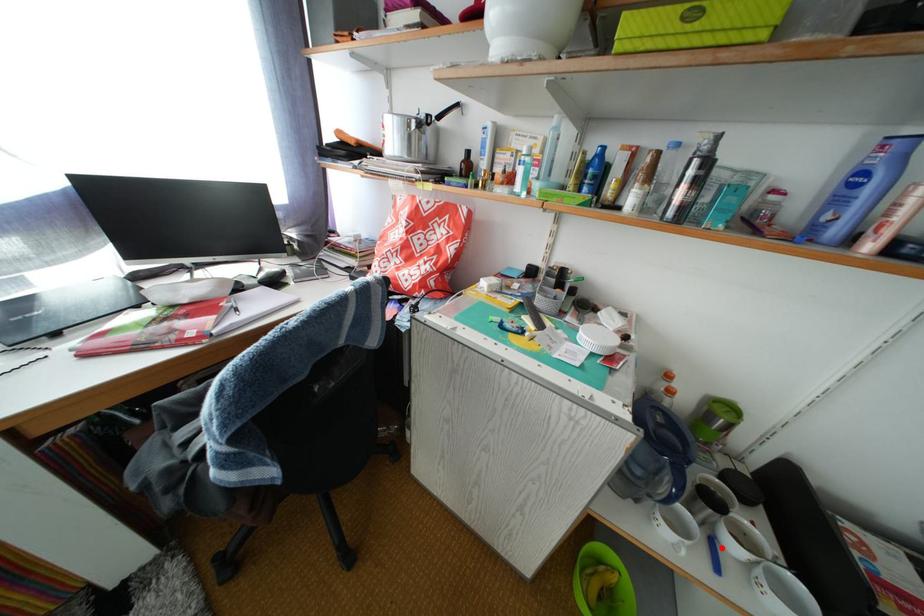
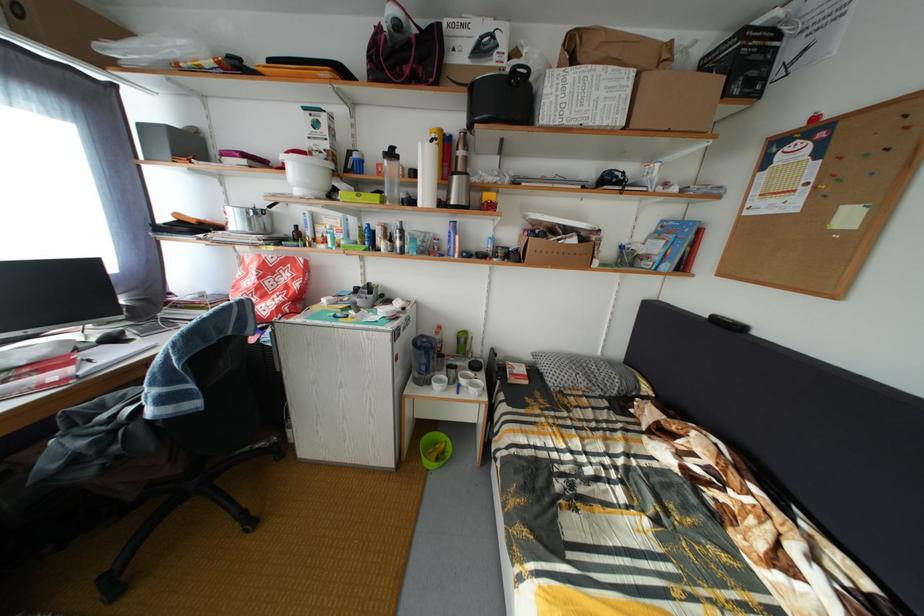
Locate, in the second image, the point that corresponds to the highlighted location in the first image.

(468, 392)